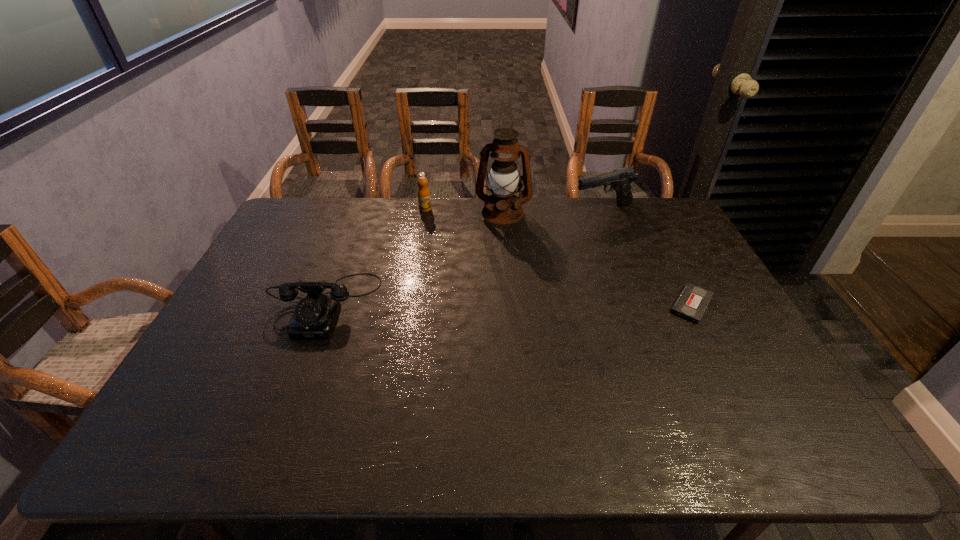
Locate an element on the screen. The width and height of the screenshot is (960, 540). gun that is at the far edge is located at coordinates (620, 180).

Locate an element on the screen. The width and height of the screenshot is (960, 540). object located at the left edge is located at coordinates (315, 315).

Identify the location of videotape present at the right edge. [693, 300].

Identify the location of gun that is at the right edge. The image size is (960, 540). (620, 180).

Identify the location of object that is at the far right corner. This screenshot has width=960, height=540. (620, 180).

Find the location of a particular element. This screenshot has height=540, width=960. vacant space at the far edge of the desktop is located at coordinates (450, 227).

Locate an element on the screen. vacant space at the near edge of the desktop is located at coordinates (301, 379).

The height and width of the screenshot is (540, 960). In the image, there is a desktop. What are the coordinates of `vacant space at the right edge` in the screenshot? It's located at (674, 260).

You are a GUI agent. You are given a task and a screenshot of the screen. Output one action in this format:
    pyautogui.click(x=<x>, y=<y>)
    Task: Click on the free area in between the videotape and the gun
    
    Given the screenshot: What is the action you would take?
    pyautogui.click(x=647, y=257)

Identify the location of empty location between the tallest object and the telephone. The height and width of the screenshot is (540, 960). (414, 259).